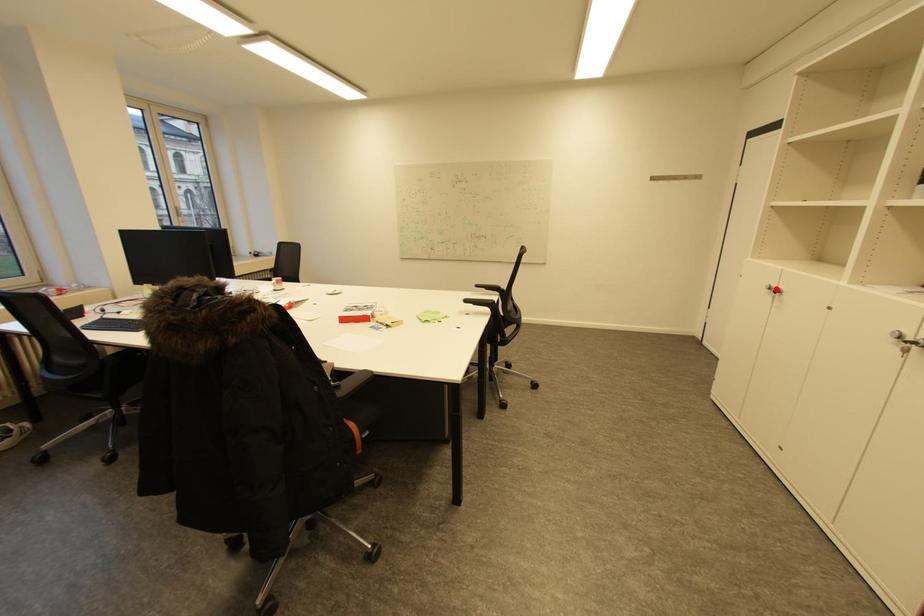
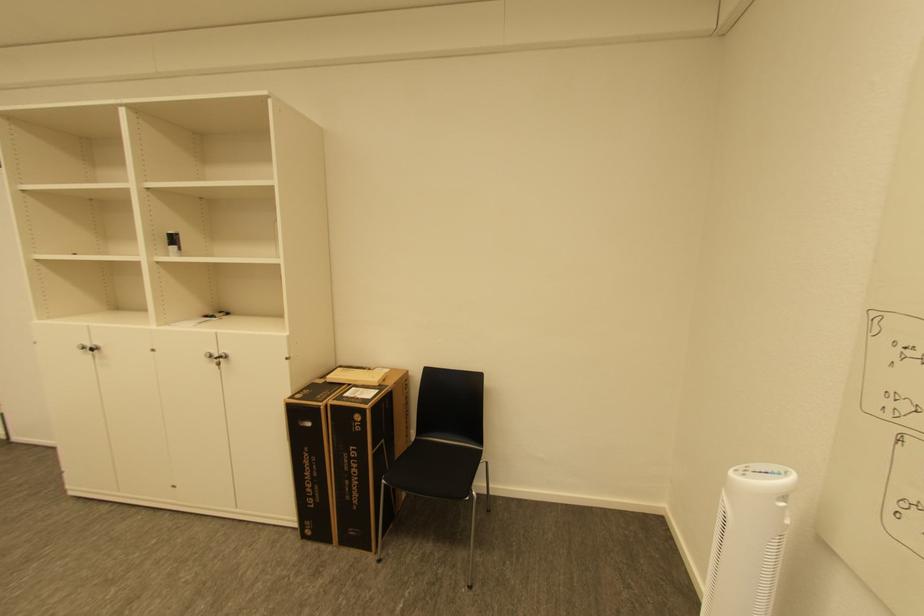
In the second image, find the point that corresponds to the highlighted location in the first image.

(91, 347)